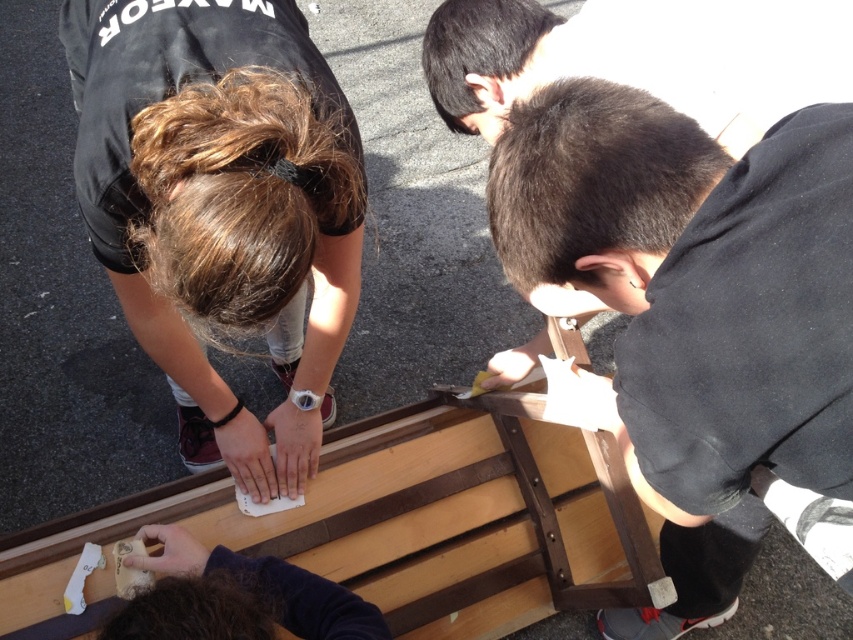
Question: In this image, where is matte black shirt at upper left located relative to black matte wood at center?

Choices:
 (A) above
 (B) below

Answer: (B)

Question: Which point is closer to the camera?

Choices:
 (A) (381, 515)
 (B) (849, 378)
 (C) (264, 259)

Answer: (B)

Question: Can you confirm if wooden plank at center is smaller than black matte wood at center?

Choices:
 (A) no
 (B) yes

Answer: (A)

Question: Can you confirm if wooden plank at center is positioned to the right of black matte wood at center?

Choices:
 (A) yes
 (B) no

Answer: (B)

Question: Which object is the farthest from the black matte wood at center?

Choices:
 (A) matte black shirt at upper left
 (B) wooden plank at center
 (C) smooth brown wood at center

Answer: (B)

Question: Estimate the real-world distances between objects in this image. Which object is closer to the black matte wood at center?

Choices:
 (A) wooden plank at center
 (B) smooth brown wood at center

Answer: (B)